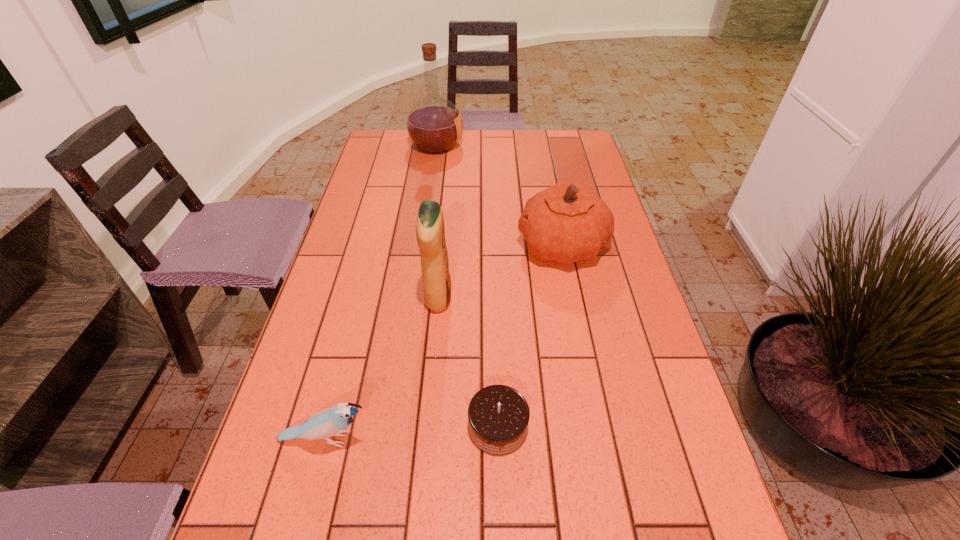
Where is `the farthest object`? Image resolution: width=960 pixels, height=540 pixels. the farthest object is located at coordinates (434, 124).

Locate an element on the screen. the tallest object is located at coordinates (434, 124).

Identify the location of detergent. The width and height of the screenshot is (960, 540). (430, 232).

You are a GUI agent. You are given a task and a screenshot of the screen. Output one action in this format:
    pyautogui.click(x=<x>, y=<y>)
    Task: Click on the third farthest object
    The width and height of the screenshot is (960, 540).
    Given the screenshot: What is the action you would take?
    pyautogui.click(x=430, y=232)

I want to click on the third tallest object, so [x=566, y=223].

Identify the location of the rightmost object. This screenshot has width=960, height=540. (566, 223).

Image resolution: width=960 pixels, height=540 pixels. Identify the location of the second shortest object. (330, 422).

Locate an element on the screen. the shortest object is located at coordinates (498, 415).

Image resolution: width=960 pixels, height=540 pixels. In order to click on chocolate cake in this screenshot , I will do `click(498, 415)`.

Locate an element on the screen. The width and height of the screenshot is (960, 540). free space located on the front label of the farthest object is located at coordinates (485, 145).